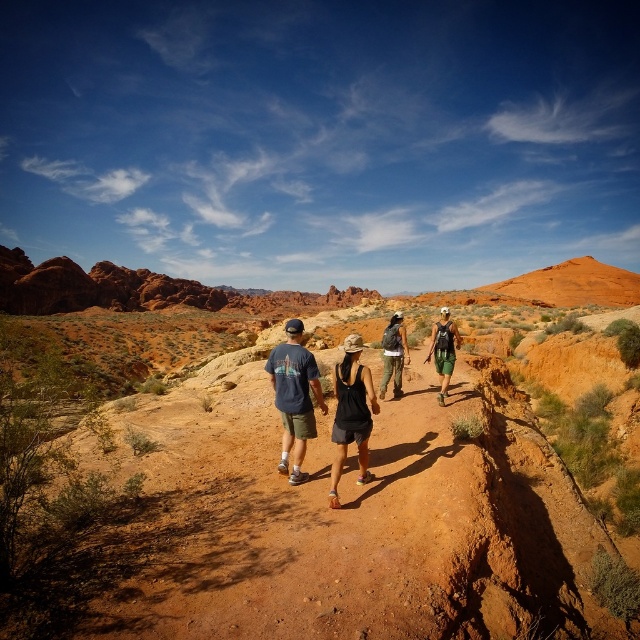
You are a drone operator trying to capture aerial footage of the desert trail. You notice two specific points marked on your map at coordinates point (292,321) and point (385,326). Which point should you prioritize for a closer shot to ensure the hikers are visible in the foreground?

Point (292,321) should be prioritized because it is closer to the camera, making the hikers more visible in the foreground compared to point (385,326) which is farther away.